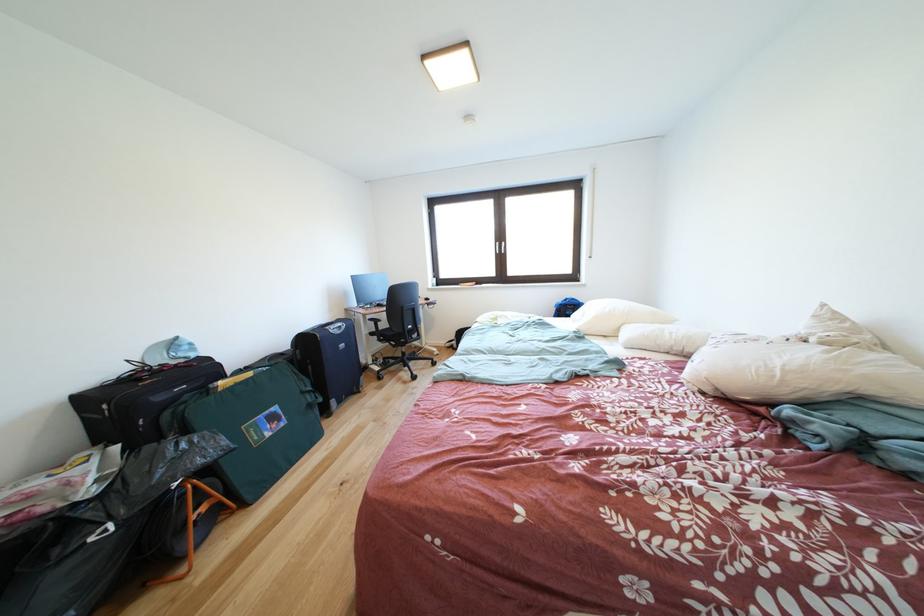
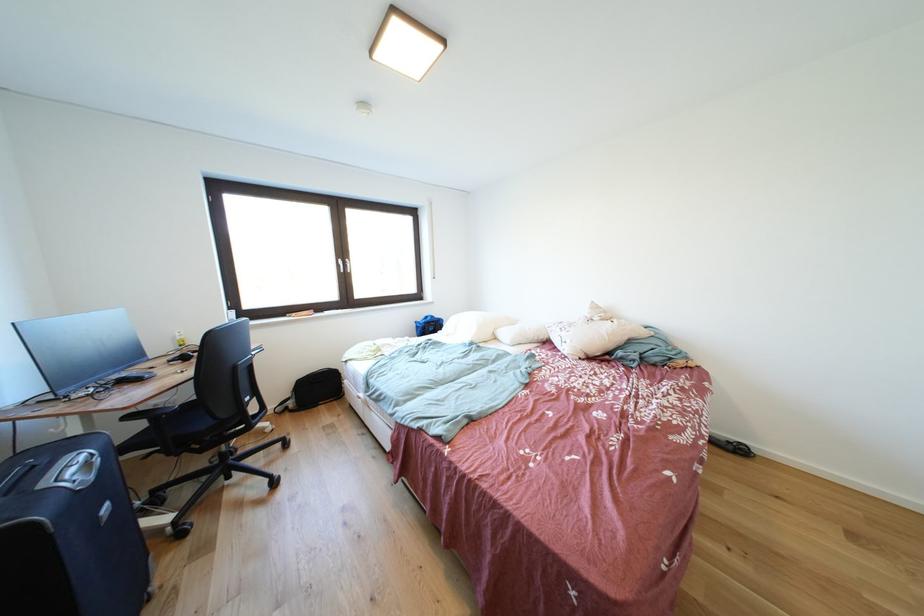
Where in the second image is the point corresponding to point 505,249 from the first image?

(348, 265)